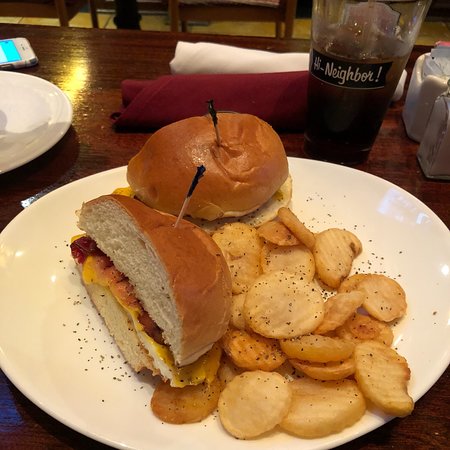
The image size is (450, 450). Find the location of `chair legs`. chair legs is located at coordinates (173, 25), (289, 20).